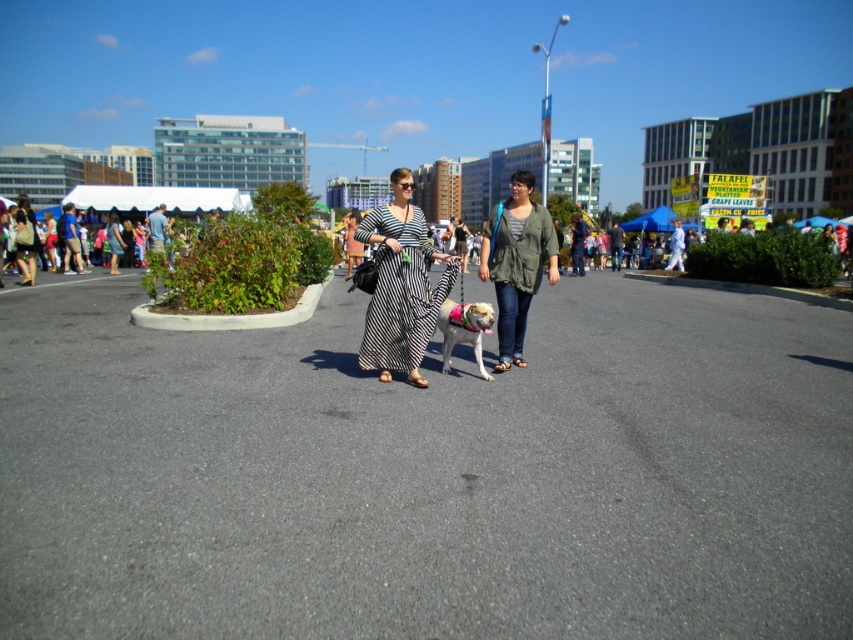
Looking at this image, does black striped dress at center appear under green textured jacket at center?

Indeed, black striped dress at center is positioned under green textured jacket at center.

Does black striped dress at center have a smaller size compared to green textured jacket at center?

Yes.

Who is more forward, (434, 316) or (502, 268)?

Point (434, 316) is more forward.

At what (x,y) coordinates should I click in order to perform the action: click on black striped dress at center. Please return your answer as a coordinate pair (x, y). Looking at the image, I should click on (399, 291).